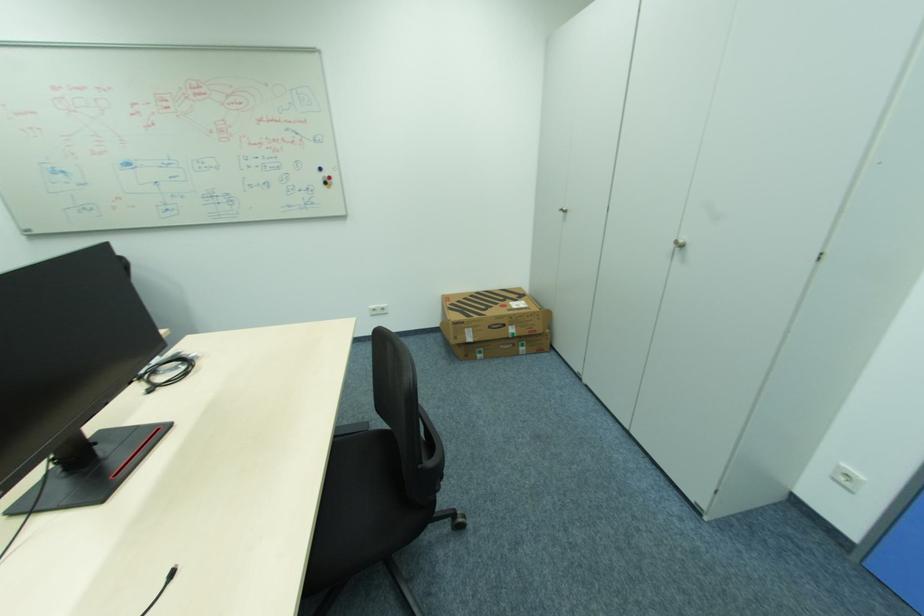
This screenshot has height=616, width=924. What are the coordinates of `whiteboard magnet` in the screenshot? It's located at (326, 180).